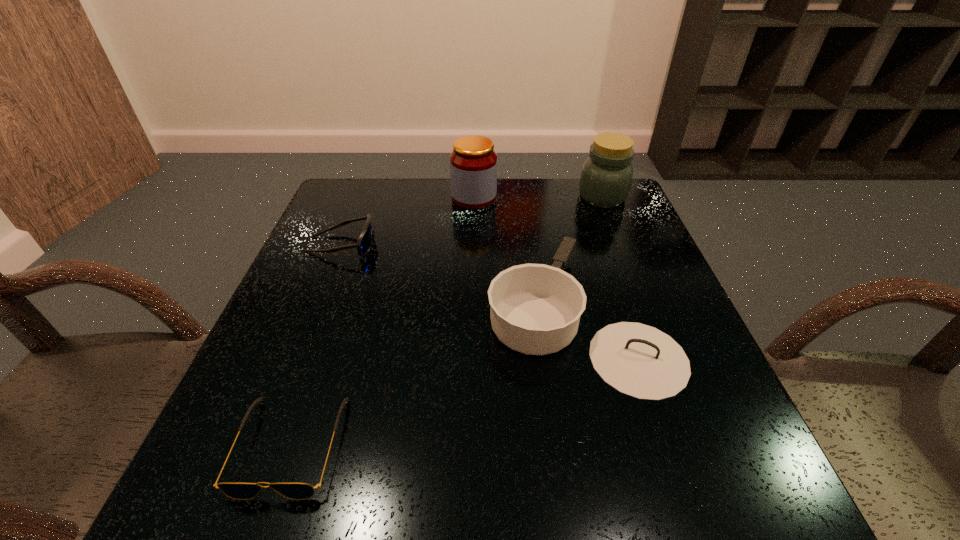
This screenshot has height=540, width=960. Identify the location of vacant space at the far left corner. (352, 179).

This screenshot has height=540, width=960. Identify the location of vacant space at the near right corner of the desktop. (752, 468).

This screenshot has height=540, width=960. I want to click on free space that is in between the third shortest object and the shortest object, so click(434, 380).

Where is `vacant point located between the right jar and the nearer sunglasses`? This screenshot has height=540, width=960. vacant point located between the right jar and the nearer sunglasses is located at coordinates (446, 321).

Locate an element on the screen. This screenshot has height=540, width=960. vacant space that is in between the nearer sunglasses and the third shortest object is located at coordinates (434, 380).

Identify the location of vacant space in between the saucepan and the right jar. (589, 256).

Identify the location of free spot between the third shortest object and the right jar. Image resolution: width=960 pixels, height=540 pixels. (589, 256).

Where is `free spot between the left jar and the right jar`? Image resolution: width=960 pixels, height=540 pixels. free spot between the left jar and the right jar is located at coordinates (538, 197).

Locate an element on the screen. empty space between the farther sunglasses and the left jar is located at coordinates (408, 221).

Find the location of a particular element. This screenshot has height=540, width=960. free space between the right jar and the shortest object is located at coordinates (446, 321).